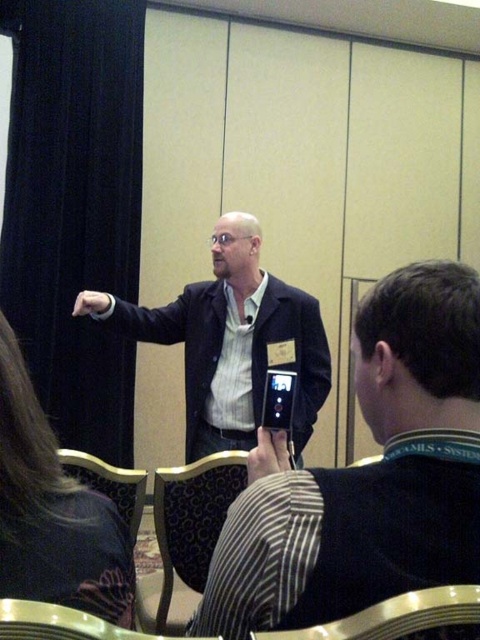
Is matte black suit at center bigger than patterned fabric chair at lower center?

Indeed, matte black suit at center has a larger size compared to patterned fabric chair at lower center.

Can you confirm if matte black suit at center is taller than patterned fabric chair at lower center?

Yes.

You are a GUI agent. You are given a task and a screenshot of the screen. Output one action in this format:
    pyautogui.click(x=<x>, y=<y>)
    Task: Click on the matte black suit at center
    
    Given the screenshot: What is the action you would take?
    pyautogui.click(x=230, y=339)

Between gold fabric chair at lower center and patterned fabric chair at lower left, which one is positioned higher?

gold fabric chair at lower center is above.

Is gold fabric chair at lower center below patterned fabric chair at lower left?

Incorrect, gold fabric chair at lower center is not positioned below patterned fabric chair at lower left.

Does point (467, 588) come in front of point (130, 515)?

Yes.

Find the location of a particular element. gold fabric chair at lower center is located at coordinates (403, 618).

Does patterned fabric chair at lower center have a smaller size compared to gold fabric chair at lower center?

Actually, patterned fabric chair at lower center might be larger than gold fabric chair at lower center.

Which is in front, point (135, 604) or point (439, 600)?

Point (439, 600) is in front.

The width and height of the screenshot is (480, 640). In order to click on patterned fabric chair at lower center in this screenshot , I will do `click(186, 536)`.